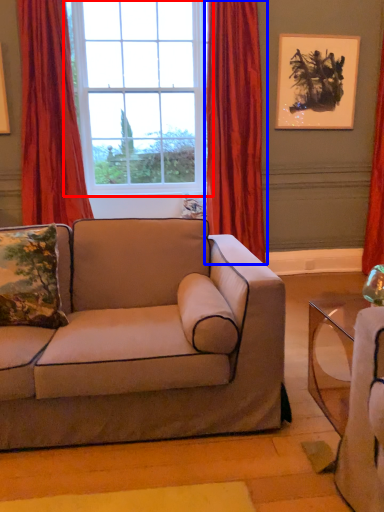
Question: Which of the following is the farthest to the observer, window (highlighted by a red box) or curtain (highlighted by a blue box)?

Choices:
 (A) window
 (B) curtain

Answer: (A)